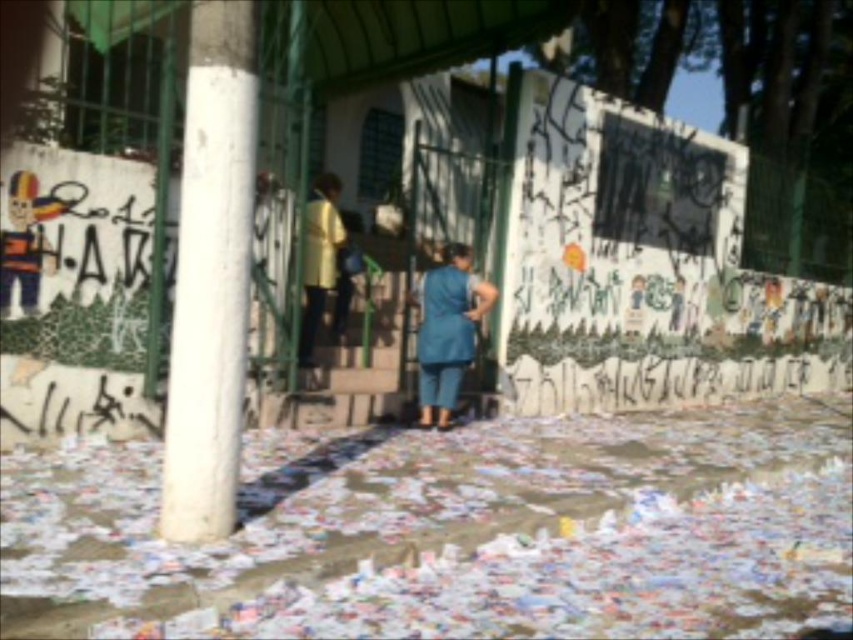
Does white concrete pillar at left appear on the left side of blue fabric dress at center?

Correct, you'll find white concrete pillar at left to the left of blue fabric dress at center.

Can you confirm if white concrete pillar at left is thinner than blue fabric dress at center?

Yes.

Is point (210, 177) closer to camera compared to point (453, 250)?

Yes, point (210, 177) is closer to viewer.

The width and height of the screenshot is (853, 640). Identify the location of white concrete pillar at left. pyautogui.click(x=212, y=275).

Is blue fabric dress at center below yellow matte shirt at center?

Correct, blue fabric dress at center is located below yellow matte shirt at center.

Which is behind, point (426, 413) or point (303, 269)?

Point (426, 413)

At what (x,y) coordinates should I click in order to perform the action: click on blue fabric dress at center. Please return your answer as a coordinate pair (x, y). Looking at the image, I should click on (448, 330).

Is white concrete pillar at left to the right of yellow matte shirt at center from the viewer's perspective?

Correct, you'll find white concrete pillar at left to the right of yellow matte shirt at center.

Does white concrete pillar at left have a greater width compared to yellow matte shirt at center?

Correct, the width of white concrete pillar at left exceeds that of yellow matte shirt at center.

What are the coordinates of `white concrete pillar at left` in the screenshot? It's located at (212, 275).

Where is `white concrete pillar at left`? white concrete pillar at left is located at coordinates (212, 275).